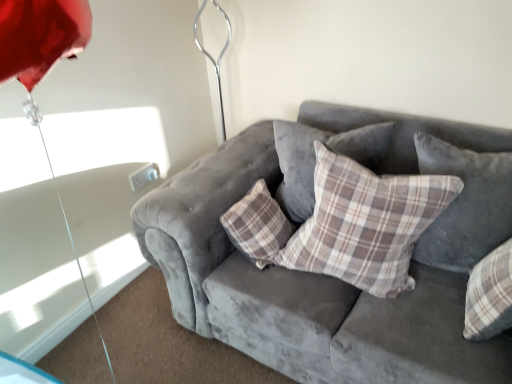
Question: In which direction should I rotate to look at plaid fabric pillow at center, arranged as the 3th pillow when viewed from the left?

Choices:
 (A) right
 (B) left

Answer: (A)

Question: Is plaid fabric pillow at center, positioned as the third pillow in right-to-left order, at the back of plaid fabric pillow at center, the 2th pillow from the right?

Choices:
 (A) no
 (B) yes

Answer: (B)

Question: Is plaid fabric pillow at center, the 2th pillow from the right, not inside plaid fabric pillow at center, positioned as the 1th pillow in left-to-right order?

Choices:
 (A) no
 (B) yes

Answer: (B)

Question: Is plaid fabric pillow at center, the 2th pillow from the right, wider than plaid fabric pillow at center, positioned as the 1th pillow in left-to-right order?

Choices:
 (A) no
 (B) yes

Answer: (B)

Question: Considering the relative positions of plaid fabric pillow at center, the 2th pillow from the right, and plaid fabric pillow at center, positioned as the third pillow in right-to-left order, in the image provided, is plaid fabric pillow at center, the 2th pillow from the right, behind plaid fabric pillow at center, positioned as the third pillow in right-to-left order,?

Choices:
 (A) yes
 (B) no

Answer: (B)

Question: From a real-world perspective, is plaid fabric pillow at center, the second pillow positioned from the left, positioned under plaid fabric pillow at center, positioned as the 1th pillow in left-to-right order, based on gravity?

Choices:
 (A) no
 (B) yes

Answer: (A)

Question: From the image's perspective, is plaid fabric pillow at center, the 2th pillow from the right, above plaid fabric pillow at center, positioned as the 1th pillow in left-to-right order?

Choices:
 (A) no
 (B) yes

Answer: (A)

Question: Can we say plaid fabric pillow at center, which is counted as the 1th pillow, starting from the right, lies outside velvet gray couch at center?

Choices:
 (A) yes
 (B) no

Answer: (B)

Question: Considering the relative sizes of plaid fabric pillow at center, which is counted as the 1th pillow, starting from the right, and velvet gray couch at center in the image provided, is plaid fabric pillow at center, which is counted as the 1th pillow, starting from the right, bigger than velvet gray couch at center?

Choices:
 (A) yes
 (B) no

Answer: (B)

Question: From a real-world perspective, is plaid fabric pillow at center, arranged as the 3th pillow when viewed from the left, below velvet gray couch at center?

Choices:
 (A) yes
 (B) no

Answer: (B)

Question: Does plaid fabric pillow at center, which is counted as the 1th pillow, starting from the right, have a lesser width compared to velvet gray couch at center?

Choices:
 (A) yes
 (B) no

Answer: (A)

Question: Is plaid fabric pillow at center, arranged as the 3th pillow when viewed from the left, turned away from velvet gray couch at center?

Choices:
 (A) no
 (B) yes

Answer: (B)

Question: Is plaid fabric pillow at center, arranged as the 3th pillow when viewed from the left, taller than velvet gray couch at center?

Choices:
 (A) yes
 (B) no

Answer: (B)

Question: Does velvet gray couch at center appear on the right side of plaid fabric pillow at center, arranged as the 3th pillow when viewed from the left?

Choices:
 (A) no
 (B) yes

Answer: (A)